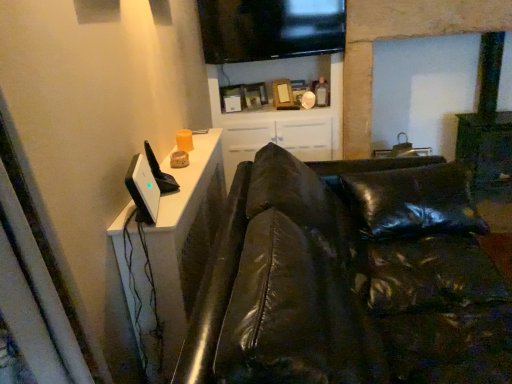
Question: From the image's perspective, is flat screen tv at upper center located above or below white glossy dresser at upper left?

Choices:
 (A) above
 (B) below

Answer: (A)

Question: Is flat screen tv at upper center bigger or smaller than white glossy dresser at upper left?

Choices:
 (A) big
 (B) small

Answer: (B)

Question: Based on their relative distances, which object is nearer to the flat screen tv at upper center?

Choices:
 (A) white glossy cabinet at upper center
 (B) white glossy dresser at upper left
 (C) black leather couch at left

Answer: (A)

Question: Which of these objects is positioned farthest from the flat screen tv at upper center?

Choices:
 (A) white glossy dresser at upper left
 (B) white glossy cabinet at upper center
 (C) black leather couch at left

Answer: (C)